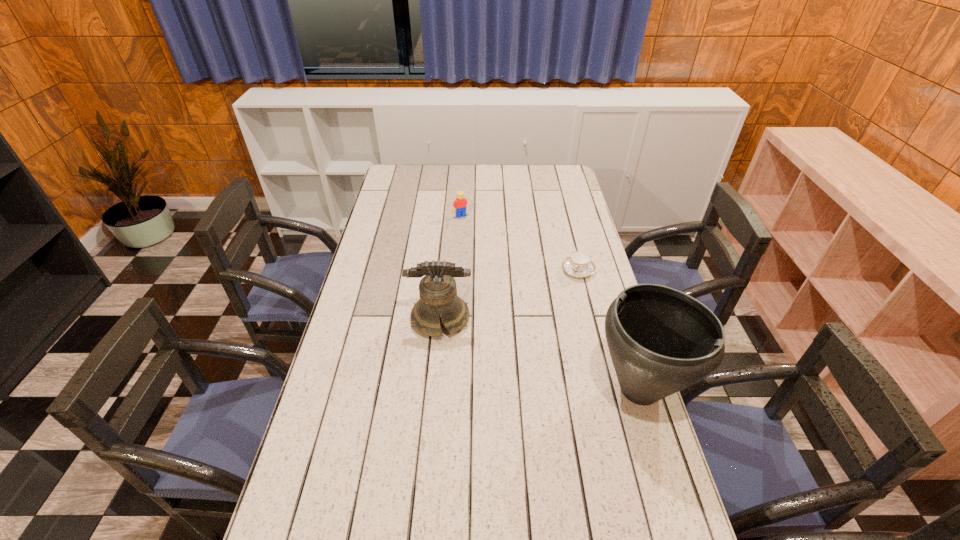
Locate an element on the screen. The height and width of the screenshot is (540, 960). free space on the desktop that is between the second nearest object and the nearest object and is positioned on the face of the Lego is located at coordinates (558, 360).

Locate an element on the screen. free space on the desktop that is between the second nearest object and the nearest object and is positioned on the side with the handle of the second farthest object is located at coordinates (535, 352).